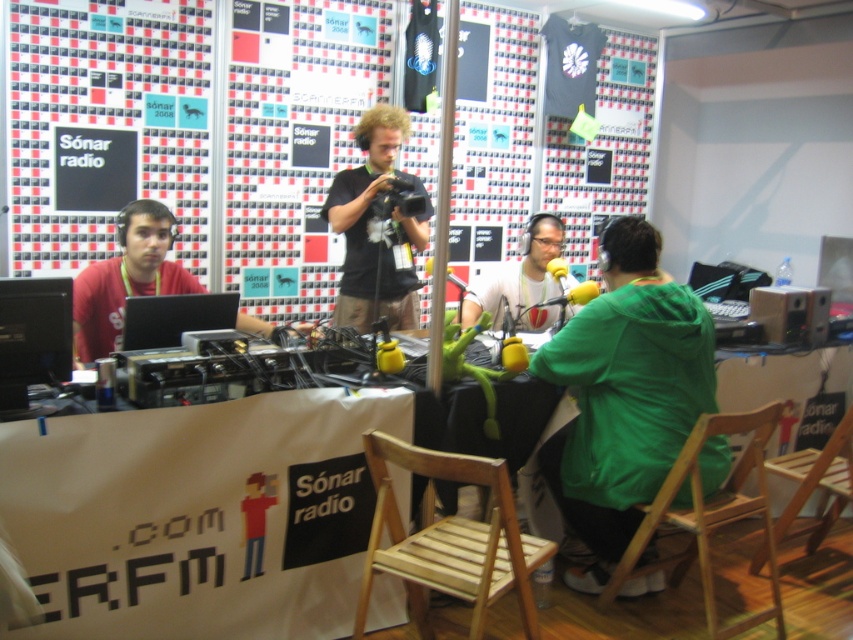
You are a photographer at the Sonor 2008 event and you need to take a photo of the camera setup. The camera you have is at center and there is a person wearing a green matte jacket also at center. Can you see the entire matte black camera at center in your photo without any obstruction from the green matte jacket at center?

The green matte jacket at center is behind the matte black camera at center, so yes, you can see the entire matte black camera at center in your photo without any obstruction from the green matte jacket at center.